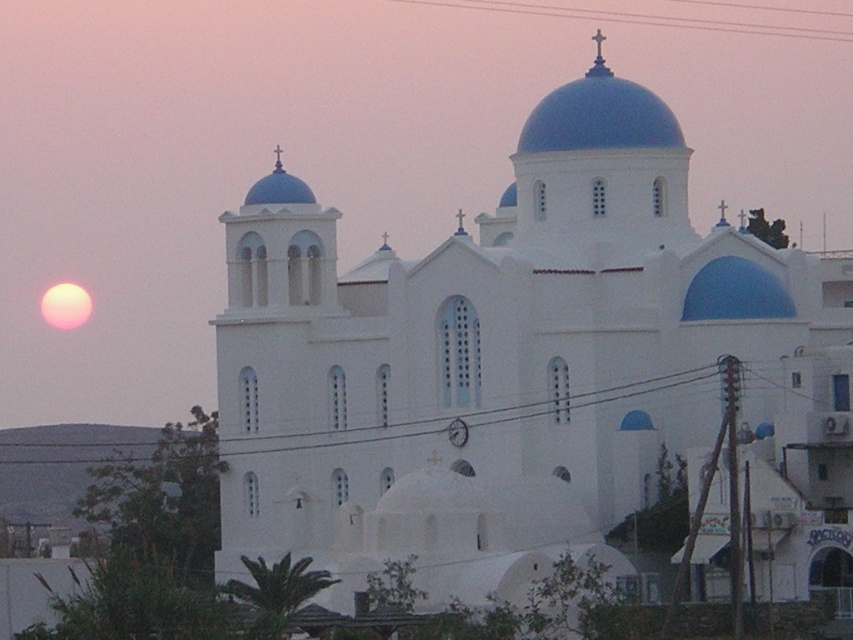
Between white smooth church at center and metallic wire at upper center, which one is positioned lower?

white smooth church at center

Does white smooth church at center have a greater height compared to metallic wire at upper center?

Correct, white smooth church at center is much taller as metallic wire at upper center.

Between point (560, 465) and point (772, 28), which one is positioned in front?

Point (560, 465) is more forward.

This screenshot has height=640, width=853. Find the location of `white smooth church at center`. white smooth church at center is located at coordinates (496, 358).

Measure the distance between metallic wire at upper center and camera.

They are 196.29 meters apart.

Can you confirm if metallic wire at upper center is positioned below black wire at lower center?

Actually, metallic wire at upper center is above black wire at lower center.

Locate an element on the screen. The height and width of the screenshot is (640, 853). metallic wire at upper center is located at coordinates (637, 19).

Is white smooth church at center positioned before black wire at lower center?

Yes, it is.

Who is more forward, (442,387) or (19,458)?

Positioned in front is point (442,387).

Who is more distant from viewer, (495, 218) or (125, 435)?

The point (125, 435) is more distant.

What are the coordinates of `white smooth church at center` in the screenshot? It's located at point(496,358).